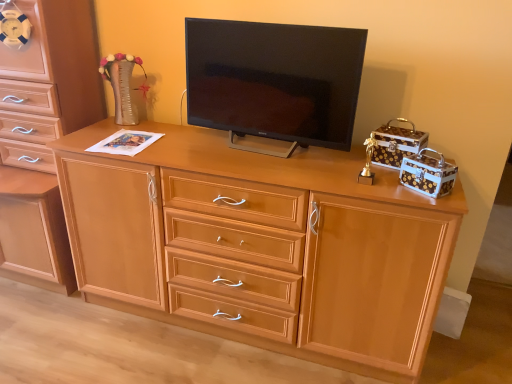
Question: Is light brown wood chest of drawers at left positioned with its back to light wood cabinet at center?

Choices:
 (A) no
 (B) yes

Answer: (A)

Question: Is light brown wood chest of drawers at left bigger than light wood cabinet at center?

Choices:
 (A) yes
 (B) no

Answer: (A)

Question: Does light brown wood chest of drawers at left have a greater width compared to light wood cabinet at center?

Choices:
 (A) yes
 (B) no

Answer: (A)

Question: From a real-world perspective, is light brown wood chest of drawers at left beneath light wood cabinet at center?

Choices:
 (A) yes
 (B) no

Answer: (B)

Question: Would you say light brown wood chest of drawers at left contains light wood cabinet at center?

Choices:
 (A) no
 (B) yes

Answer: (A)

Question: From the image's perspective, relative to matte black tv at center, is light brown wood chest of drawers at left above or below?

Choices:
 (A) above
 (B) below

Answer: (B)

Question: Looking at the image, does light brown wood chest of drawers at left seem bigger or smaller compared to matte black tv at center?

Choices:
 (A) big
 (B) small

Answer: (A)

Question: In the image, is light brown wood chest of drawers at left positioned in front of or behind matte black tv at center?

Choices:
 (A) behind
 (B) front

Answer: (A)

Question: Is point (29, 9) positioned closer to the camera than point (302, 41)?

Choices:
 (A) closer
 (B) farther

Answer: (B)

Question: In terms of size, does light wood cabinet at center appear bigger or smaller than light brown wood chest of drawers at left?

Choices:
 (A) big
 (B) small

Answer: (B)

Question: Is light wood cabinet at center to the left or to the right of light brown wood chest of drawers at left in the image?

Choices:
 (A) right
 (B) left

Answer: (A)

Question: Does point (199, 188) appear closer or farther from the camera than point (25, 170)?

Choices:
 (A) closer
 (B) farther

Answer: (A)

Question: Relative to light brown wood chest of drawers at left, is light wood cabinet at center in front or behind?

Choices:
 (A) behind
 (B) front

Answer: (B)

Question: From the image's perspective, is matte black tv at center located above or below light brown wood chest of drawers at left?

Choices:
 (A) below
 (B) above

Answer: (B)

Question: Considering the positions of matte black tv at center and light brown wood chest of drawers at left in the image, is matte black tv at center bigger or smaller than light brown wood chest of drawers at left?

Choices:
 (A) big
 (B) small

Answer: (B)